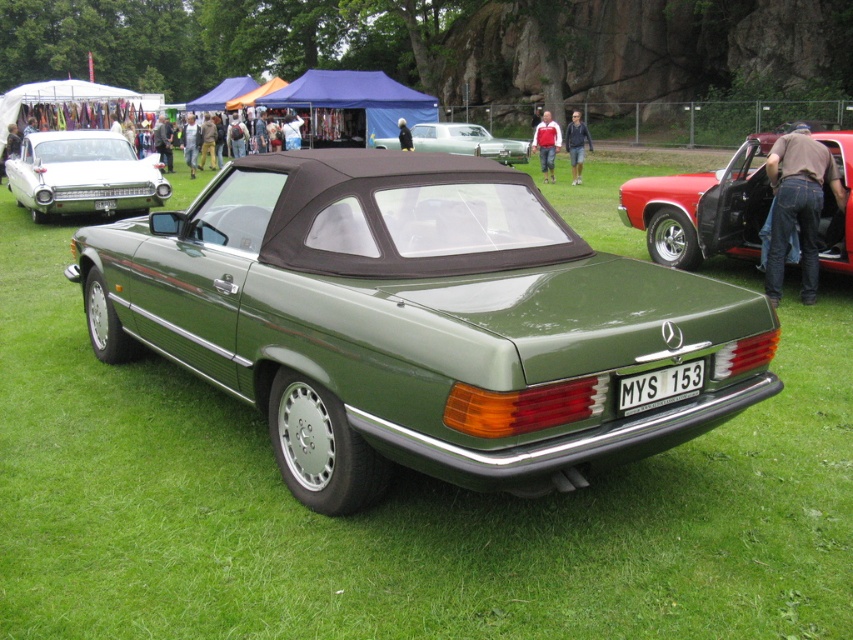
Question: Is green glossy convertible at center smaller than white plastic license plate at center?

Choices:
 (A) yes
 (B) no

Answer: (B)

Question: Which point appears closest to the camera in this image?

Choices:
 (A) (730, 198)
 (B) (645, 401)
 (C) (97, 205)
 (D) (514, 141)

Answer: (B)

Question: Among these objects, which one is nearest to the camera?

Choices:
 (A) white plastic license plate at center
 (B) white glossy sedan at left
 (C) metallic silver car at center

Answer: (A)

Question: Can you confirm if green glossy convertible at center is wider than metallic silver car at center?

Choices:
 (A) yes
 (B) no

Answer: (A)

Question: Is green glossy convertible at center in front of shiny red car at right?

Choices:
 (A) yes
 (B) no

Answer: (A)

Question: Which object is farther from the camera taking this photo?

Choices:
 (A) white glossy sedan at left
 (B) green matte convertible at center
 (C) shiny red car at right

Answer: (A)